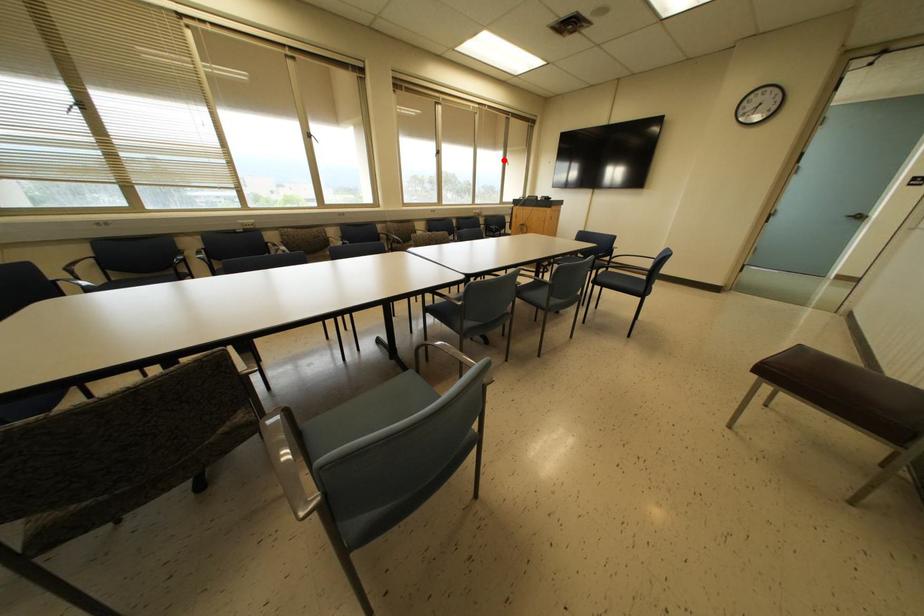
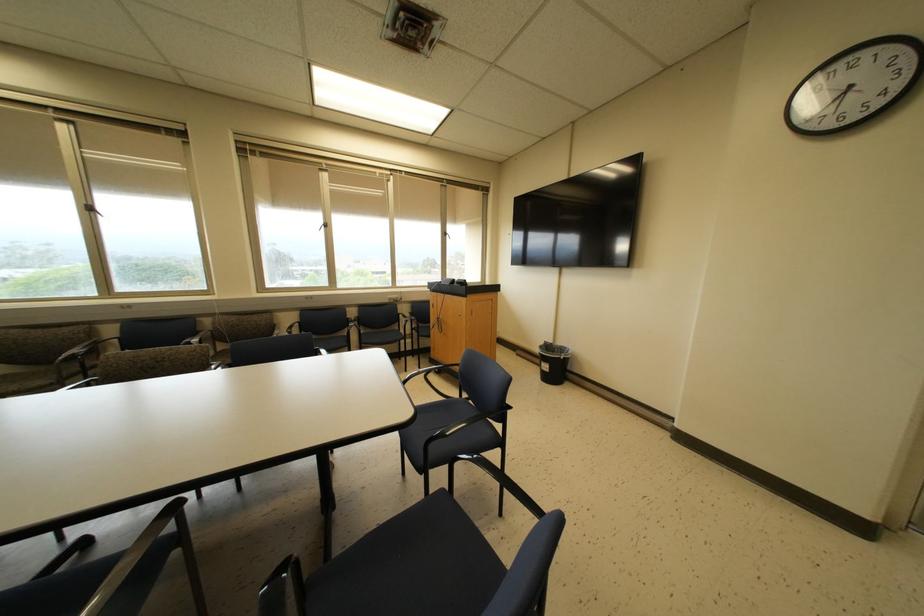
Question: I am providing you with two images of the same scene from different viewpoints. Image1 has a red point marked. In image2, the corresponding 3D location appears at what relative position? Reply with the corresponding letter.

Choices:
 (A) Closer
 (B) Farther

Answer: (B)